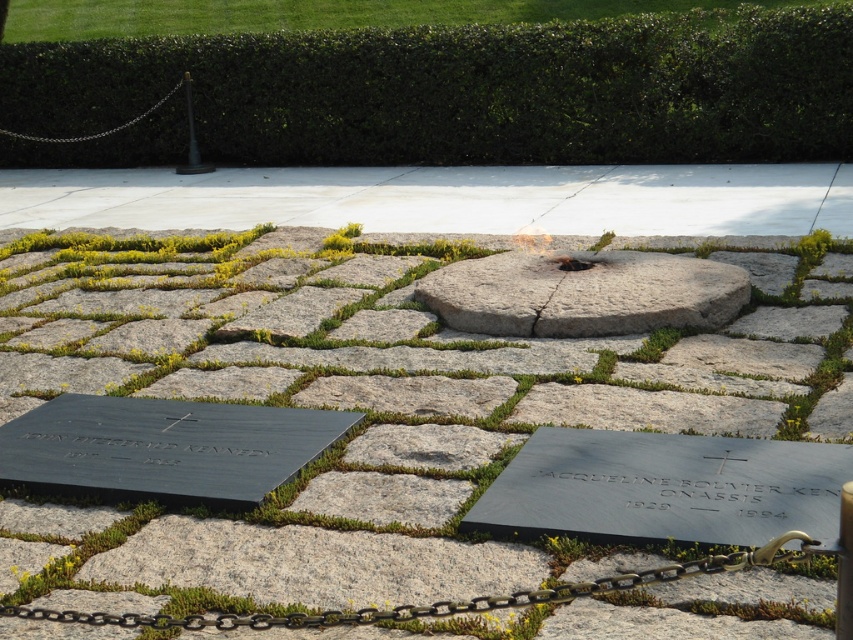
Is green leafy hedge at upper center smaller than silver metallic chain at upper left?

Yes, green leafy hedge at upper center is smaller than silver metallic chain at upper left.

Is point (651, 161) closer to camera compared to point (0, 129)?

That is True.

Is point (486, 148) positioned in front of point (21, 134)?

That is True.

Where is `green leafy hedge at upper center`? green leafy hedge at upper center is located at coordinates (471, 90).

Does gray/granite stone at center lie in front of silver metallic chain at upper left?

Yes, it is in front of silver metallic chain at upper left.

Is gray/granite stone at center behind silver metallic chain at upper left?

No, it is in front of silver metallic chain at upper left.

Is point (523, 292) farther from camera compared to point (103, 131)?

That is False.

This screenshot has width=853, height=640. What are the coordinates of `gray/granite stone at center` in the screenshot? It's located at (583, 292).

Who is positioned more to the right, black granite stone at center or silver metallic chain at upper left?

From the viewer's perspective, black granite stone at center appears more on the right side.

Measure the distance between point (660, 253) and camera.

Point (660, 253) and camera are 25.26 feet apart from each other.

Is point (846, 396) in front of point (3, 131)?

Yes, point (846, 396) is in front of point (3, 131).

Locate an element on the screen. This screenshot has height=640, width=853. black granite stone at center is located at coordinates (405, 452).